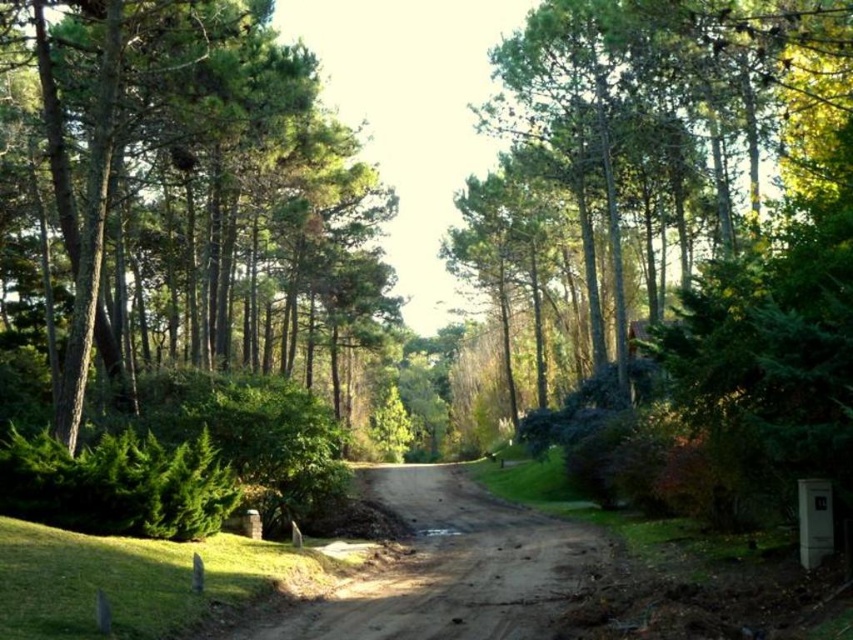
Which is above, green leafy tree at left or brown dirt track at center?

green leafy tree at left is above.

Can you confirm if green leafy tree at left is shorter than brown dirt track at center?

No.

Who is more forward, [33,12] or [459,608]?

Positioned in front is point [459,608].

Where is `green leafy tree at left`? This screenshot has height=640, width=853. green leafy tree at left is located at coordinates (198, 193).

What do you see at coordinates (651, 122) in the screenshot?
I see `green leafy tree at center` at bounding box center [651, 122].

Between green leafy tree at center and brown dirt track at center, which one has less height?

With less height is brown dirt track at center.

What do you see at coordinates (651, 122) in the screenshot? This screenshot has height=640, width=853. I see `green leafy tree at center` at bounding box center [651, 122].

Where is `green leafy tree at center`? The height and width of the screenshot is (640, 853). green leafy tree at center is located at coordinates (651, 122).

Does green leafy tree at left have a greater height compared to green leafy tree at center?

Incorrect, green leafy tree at left's height is not larger of green leafy tree at center's.

Is point (364, 284) closer to viewer compared to point (692, 156)?

No, (364, 284) is further to viewer.

At what (x,y) coordinates should I click in order to perform the action: click on green leafy tree at left. Please return your answer as a coordinate pair (x, y). This screenshot has height=640, width=853. Looking at the image, I should click on (198, 193).